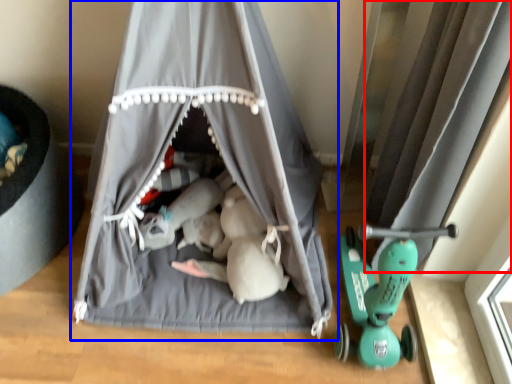
Question: Which object appears farthest to the camera in this image, curtain (highlighted by a red box) or curtain (highlighted by a blue box)?

Choices:
 (A) curtain
 (B) curtain

Answer: (A)